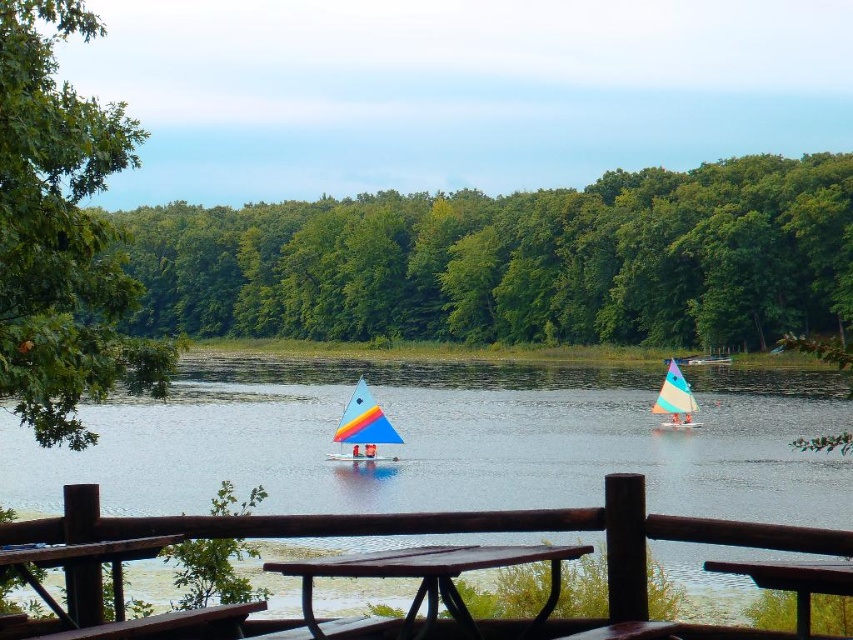
Can you confirm if transparent plastic water at center is smaller than green leafy tree at left?

Yes.

Can you confirm if transparent plastic water at center is thinner than green leafy tree at left?

Yes, transparent plastic water at center is thinner than green leafy tree at left.

What do you see at coordinates (451, 442) in the screenshot? I see `transparent plastic water at center` at bounding box center [451, 442].

At what (x,y) coordinates should I click in order to perform the action: click on transparent plastic water at center. Please return your answer as a coordinate pair (x, y). The image size is (853, 640). Looking at the image, I should click on pyautogui.click(x=451, y=442).

Between green leafy tree at left and brown wood picnic table at center, which one appears on the left side from the viewer's perspective?

Positioned to the left is green leafy tree at left.

Can you confirm if green leafy tree at left is positioned above brown wood picnic table at center?

Yes.

Where is `green leafy tree at left`? This screenshot has width=853, height=640. green leafy tree at left is located at coordinates (62, 236).

Between green leafy tree at left and rainbow sailboat at center, which one is positioned lower?

rainbow sailboat at center is lower down.

Between point (68, 419) and point (363, 440), which one is positioned behind?

Positioned behind is point (363, 440).

The width and height of the screenshot is (853, 640). Find the location of `green leafy tree at left`. green leafy tree at left is located at coordinates (62, 236).